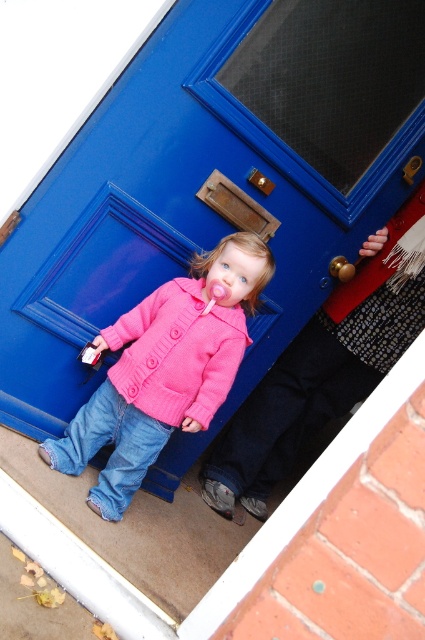
Measure the distance from blue matte door at center to pink knitted sweater at center.

blue matte door at center is 9.10 inches from pink knitted sweater at center.

Does blue matte door at center have a smaller size compared to pink knitted sweater at center?

No, blue matte door at center is not smaller than pink knitted sweater at center.

What do you see at coordinates (212, 186) in the screenshot? The height and width of the screenshot is (640, 425). I see `blue matte door at center` at bounding box center [212, 186].

At what (x,y) coordinates should I click in order to perform the action: click on blue matte door at center. Please return your answer as a coordinate pair (x, y). The image size is (425, 640). Looking at the image, I should click on (212, 186).

Can you confirm if blue matte door at center is positioned below pink knitted jacket at lower left?

Result: No, blue matte door at center is not below pink knitted jacket at lower left.

Is blue matte door at center bigger than pink knitted jacket at lower left?

Yes, blue matte door at center is bigger than pink knitted jacket at lower left.

Is point (78, 317) less distant than point (212, 408)?

No, it is not.

Image resolution: width=425 pixels, height=640 pixels. What are the coordinates of `blue matte door at center` in the screenshot? It's located at (212, 186).

Consider the image. Which is more to the right, pink knitted sweater at center or pink knitted jacket at lower left?

pink knitted jacket at lower left is more to the right.

Who is higher up, pink knitted sweater at center or pink knitted jacket at lower left?

pink knitted jacket at lower left

Is point (124, 397) positioned before point (133, 360)?

No.

The width and height of the screenshot is (425, 640). In order to click on pink knitted sweater at center in this screenshot , I will do `click(164, 369)`.